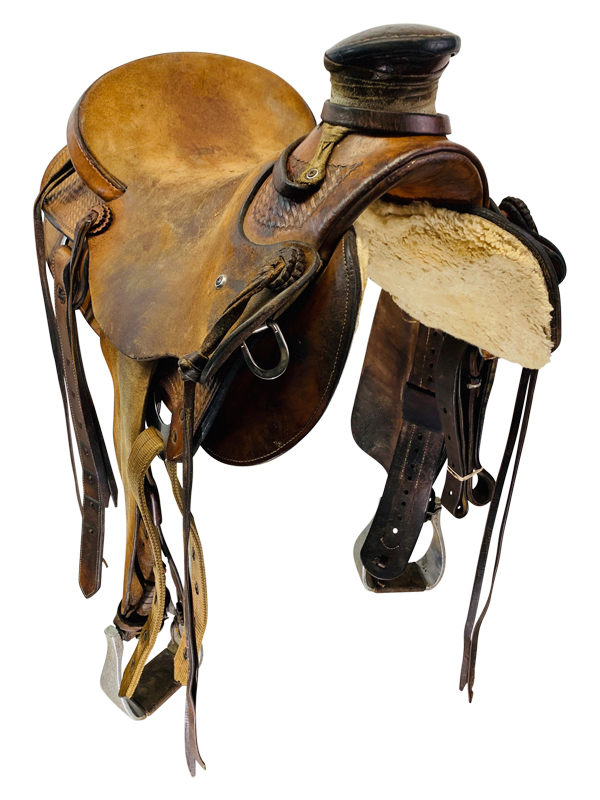
Identify the location of handle. This screenshot has height=800, width=600. (417, 56).